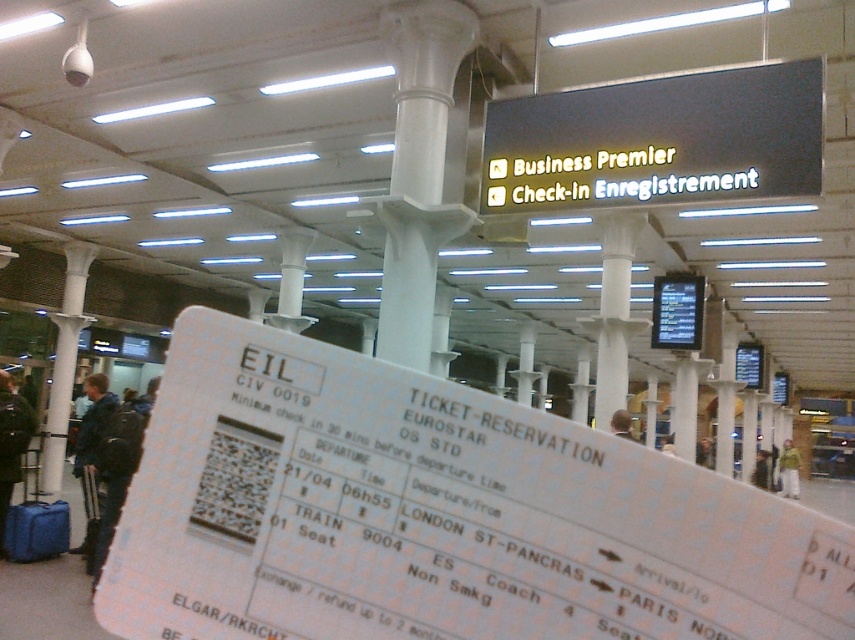
Does blue fabric suitcase at lower left come behind green fuzzy jacket at lower right?

No, it is in front of green fuzzy jacket at lower right.

What do you see at coordinates (34, 522) in the screenshot? I see `blue fabric suitcase at lower left` at bounding box center [34, 522].

Find the location of a particular element. The image size is (855, 640). blue fabric suitcase at lower left is located at coordinates (34, 522).

In the scene shown: Does light brown leather jacket at lower right have a greater height compared to light brown hair at center?

Incorrect, light brown leather jacket at lower right's height is not larger of light brown hair at center's.

Which of these two, light brown leather jacket at lower right or light brown hair at center, stands shorter?

With less height is light brown leather jacket at lower right.

Describe the element at coordinates (761, 470) in the screenshot. I see `light brown leather jacket at lower right` at that location.

Locate an element on the screen. The height and width of the screenshot is (640, 855). light brown leather jacket at lower right is located at coordinates (761, 470).

Who is taller, dark blue jacket at lower left or dark blue jacket at left?

Standing taller between the two is dark blue jacket at lower left.

What do you see at coordinates (92, 449) in the screenshot?
I see `dark blue jacket at lower left` at bounding box center [92, 449].

Identify the location of dark blue jacket at lower left. (92, 449).